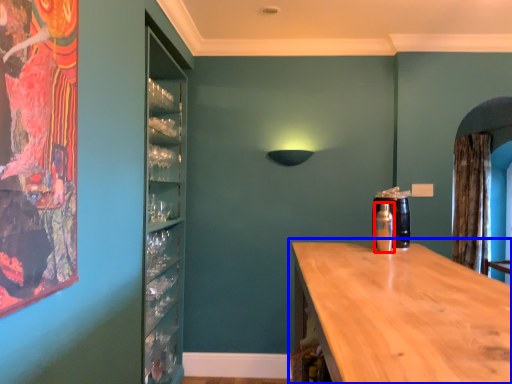
Question: Which object appears farthest to the camera in this image, bottle (highlighted by a red box) or countertop (highlighted by a blue box)?

Choices:
 (A) bottle
 (B) countertop

Answer: (A)